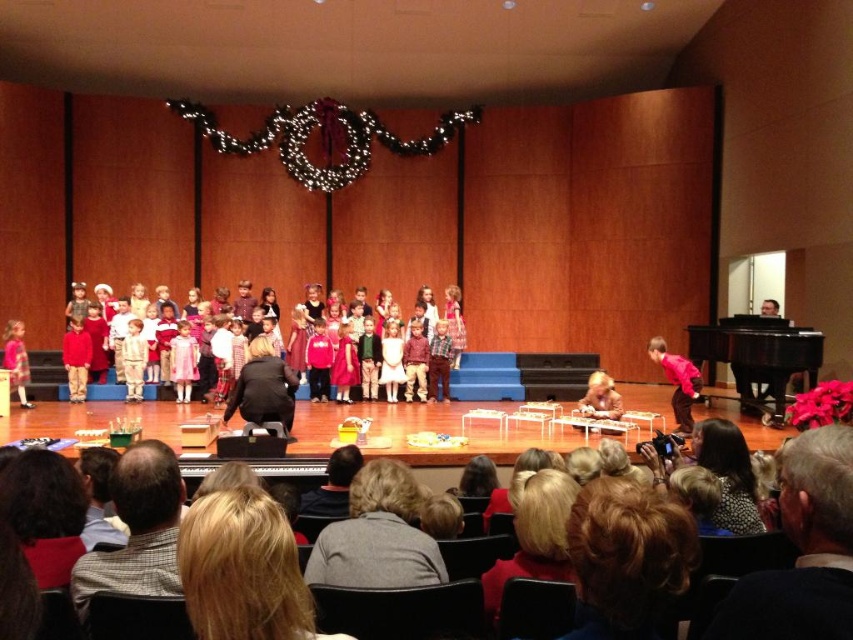
Question: Does gray checkered shirt at lower left appear on the left side of black polished piano at right?

Choices:
 (A) no
 (B) yes

Answer: (B)

Question: Which object appears closest to the camera in this image?

Choices:
 (A) black polished piano at right
 (B) gray wool sweater at lower right
 (C) gray checkered shirt at lower left
 (D) dressy red skirts at center

Answer: (B)

Question: Which object is closer to the camera taking this photo?

Choices:
 (A) gray checkered shirt at lower left
 (B) dressy red skirts at center

Answer: (A)

Question: Is gray checkered shirt at lower left to the right of dressy red skirts at center from the viewer's perspective?

Choices:
 (A) no
 (B) yes

Answer: (B)

Question: Considering the real-world distances, which object is farthest from the black polished piano at right?

Choices:
 (A) gray checkered shirt at lower left
 (B) blonde hair at lower center
 (C) gray wool sweater at lower right
 (D) smooth brown hair at center

Answer: (A)

Question: Can you confirm if blonde hair at lower center is smaller than gray checkered shirt at lower left?

Choices:
 (A) yes
 (B) no

Answer: (A)